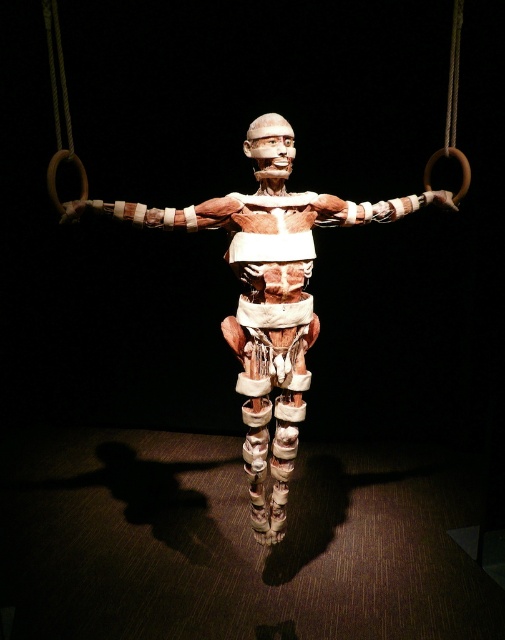
Question: Which of the following is the closest to the observer?

Choices:
 (A) matte brown anatomical model at center
 (B) wooden rings at upper center

Answer: (B)

Question: In this image, where is matte brown anatomical model at center located relative to wooden rings at upper center?

Choices:
 (A) below
 (B) above

Answer: (A)

Question: Does matte brown anatomical model at center appear under wooden rings at upper center?

Choices:
 (A) yes
 (B) no

Answer: (A)

Question: Observing the image, what is the correct spatial positioning of matte brown anatomical model at center in reference to wooden rings at upper center?

Choices:
 (A) below
 (B) above

Answer: (A)